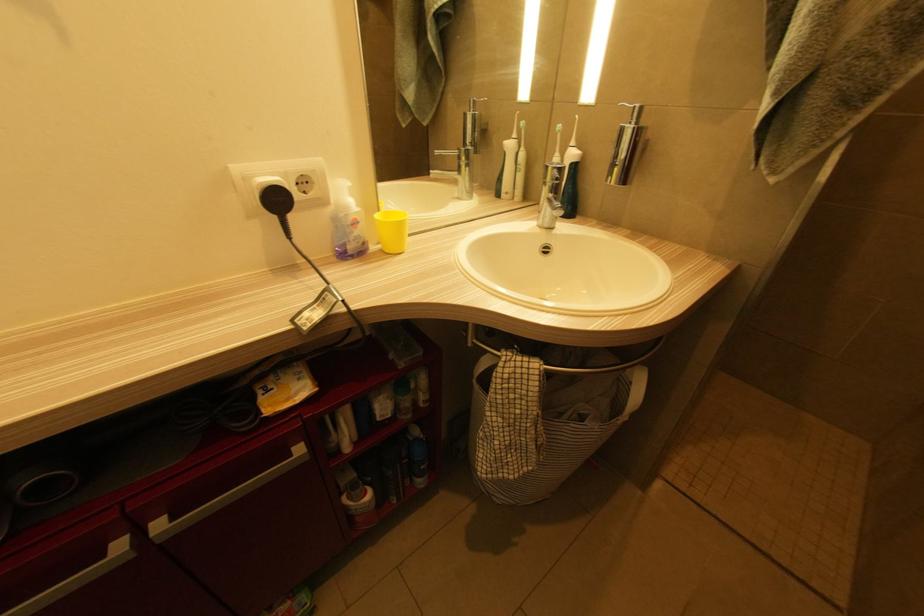
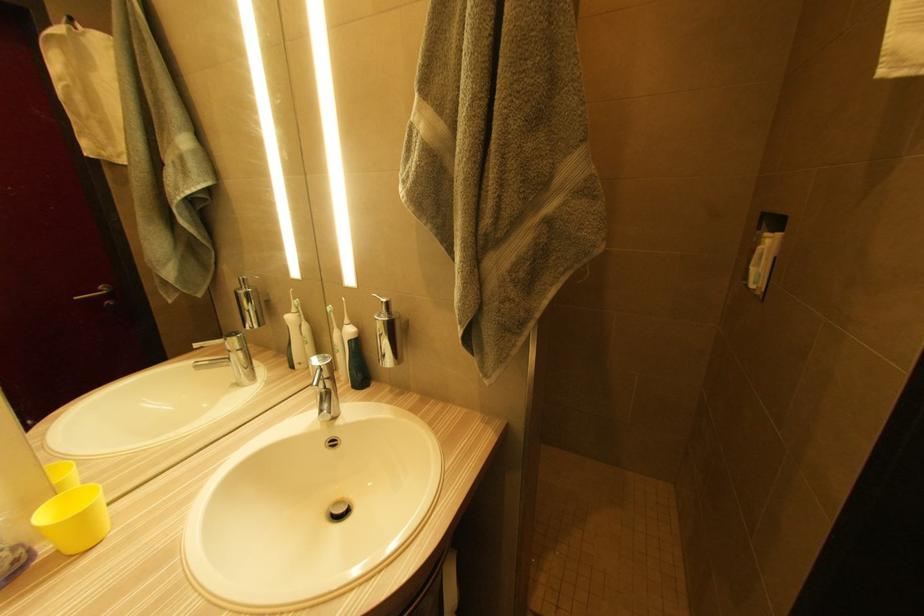
Question: The images are taken continuously from a first-person perspective. In which direction are you moving?

Choices:
 (A) Left
 (B) Right
 (C) Forward
 (D) Backward

Answer: (B)